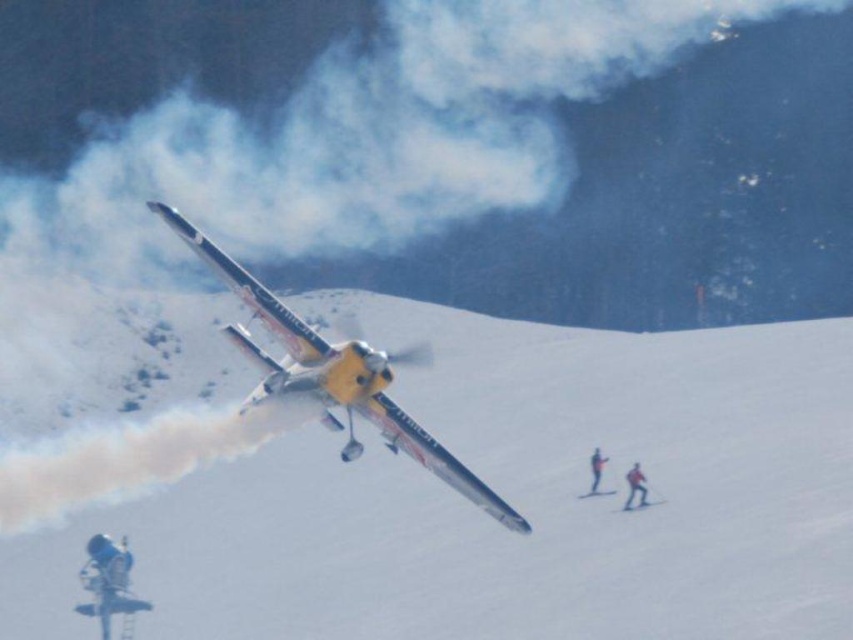
Question: Which of the following is the closest to the observer?

Choices:
 (A) yellow matte airplane at center
 (B) red fabric skier at lower right
 (C) yellow fabric skier at lower right

Answer: (A)

Question: Which point is farther from the camera taking this photo?

Choices:
 (A) (641, 502)
 (B) (592, 461)

Answer: (B)

Question: Can you confirm if red fabric skier at lower right is smaller than yellow fabric skier at lower right?

Choices:
 (A) no
 (B) yes

Answer: (B)

Question: Is red fabric skier at lower right below yellow fabric skier at lower right?

Choices:
 (A) yes
 (B) no

Answer: (A)

Question: Can you confirm if yellow matte airplane at center is positioned below yellow fabric skier at lower right?

Choices:
 (A) yes
 (B) no

Answer: (B)

Question: Which point is closer to the camera?

Choices:
 (A) red fabric skier at lower right
 (B) yellow matte airplane at center
 (C) yellow fabric skier at lower right

Answer: (B)